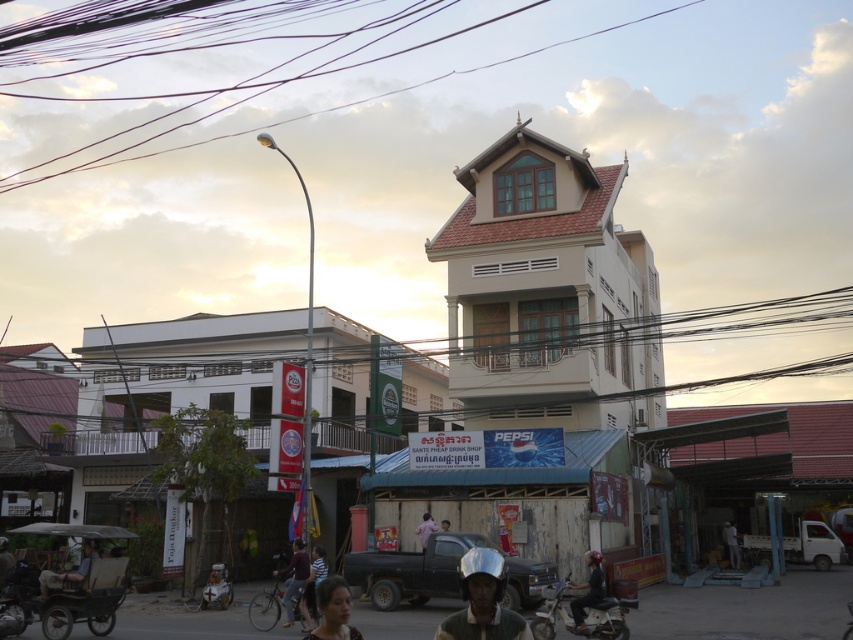
Who is more distant from viewer, (560, 600) or (314, 637)?

The point (560, 600) is behind.

Does metallic silver motorcycle at lower center have a smaller size compared to matte black helmet at lower center?

Correct, metallic silver motorcycle at lower center occupies less space than matte black helmet at lower center.

In order to click on metallic silver motorcycle at lower center in this screenshot , I will do `click(579, 614)`.

The image size is (853, 640). Find the location of `metallic silver motorcycle at lower center`. metallic silver motorcycle at lower center is located at coordinates (579, 614).

Can you confirm if purple wire at upper center is positioned below khaki fabric pants at lower left?

No.

Can you confirm if purple wire at upper center is wider than khaki fabric pants at lower left?

Yes.

Between point (48, 177) and point (88, 548), which one is positioned in front?

Point (88, 548)

Where is `purple wire at upper center`? This screenshot has height=640, width=853. purple wire at upper center is located at coordinates (282, 120).

Can you confirm if white matte truck at lower right is positioned to the right of dark brown leather jacket at lower left?

Correct, you'll find white matte truck at lower right to the right of dark brown leather jacket at lower left.

Who is lower down, white matte truck at lower right or dark brown leather jacket at lower left?

Positioned lower is white matte truck at lower right.

What do you see at coordinates (813, 545) in the screenshot? The width and height of the screenshot is (853, 640). I see `white matte truck at lower right` at bounding box center [813, 545].

At what (x,y) coordinates should I click in order to perform the action: click on white matte truck at lower right. Please return your answer as a coordinate pair (x, y). This screenshot has height=640, width=853. Looking at the image, I should click on (813, 545).